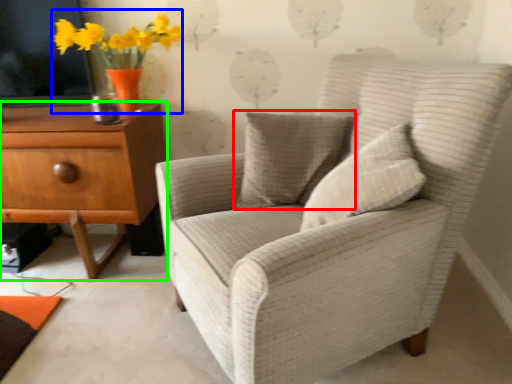
Question: Which object is the farthest from pillow (highlighted by a red box)? Choose among these: floral arrangement (highlighted by a blue box) or chest of drawers (highlighted by a green box).

Choices:
 (A) floral arrangement
 (B) chest of drawers

Answer: (A)